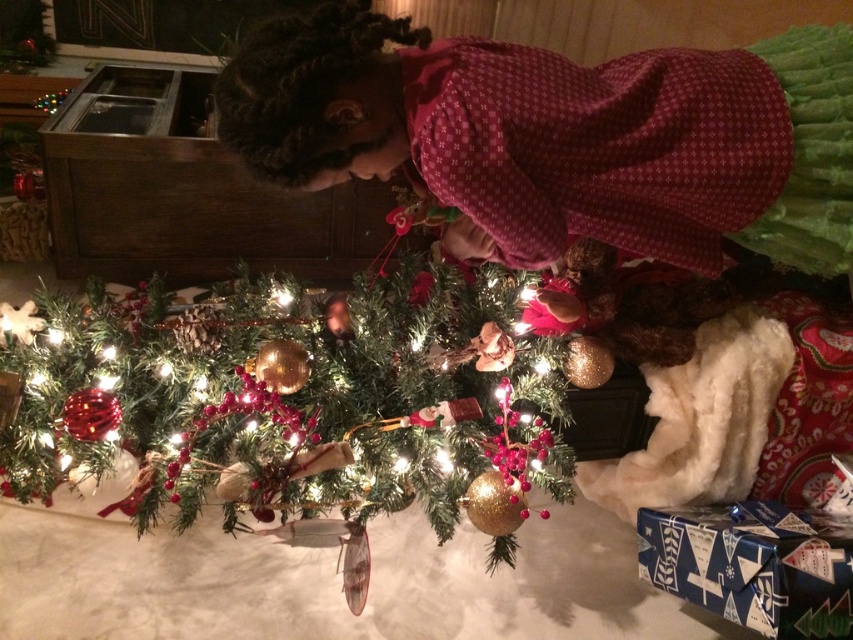
You are a parent trying to decide whether to place a new ornament on the matte red dress at center or the green textured christmas tree at center. Which object is larger and thus more suitable for the ornament?

The green textured christmas tree at center is larger than the matte red dress at center, so it is more suitable for placing the ornament.